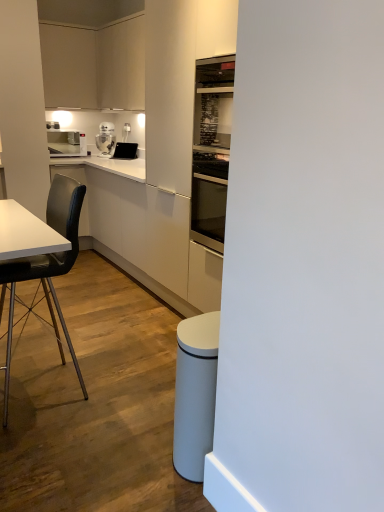
Describe the element at coordinates (94, 65) in the screenshot. I see `matte white cabinet at upper left` at that location.

What is the approximate width of matte black tablet at upper center?

matte black tablet at upper center is 24.46 centimeters wide.

Measure the distance between point (131, 150) and camera.

4.03 meters.

The width and height of the screenshot is (384, 512). What do you see at coordinates (106, 139) in the screenshot? I see `white glossy robot at upper center, arranged as the 2th kitchen appliance when viewed from the left` at bounding box center [106, 139].

Find the location of a particular element. white glossy toaster at upper left, acting as the 2th kitchen appliance starting from the right is located at coordinates (66, 143).

This screenshot has height=512, width=384. What do you see at coordinates (134, 221) in the screenshot?
I see `white glossy counter at center` at bounding box center [134, 221].

You are a GUI agent. You are given a task and a screenshot of the screen. Output one action in this format:
    pyautogui.click(x=<x>, y=<y>)
    Task: Click on the matte white cabinet at upper left
    
    Given the screenshot: What is the action you would take?
    pyautogui.click(x=94, y=65)

From the image's perspective, is black matte chair at left above white glossy counter at center?

No, from the image's perspective, black matte chair at left is not above white glossy counter at center.

Is black matte chair at left oriented away from white glossy counter at center?

That's not correct — black matte chair at left is not looking away from white glossy counter at center.

Is black matte chair at left to the right of white glossy counter at center from the viewer's perspective?

Indeed, black matte chair at left is positioned on the right side of white glossy counter at center.

Is black matte chair at left thinner than white glossy counter at center?

Indeed, black matte chair at left has a lesser width compared to white glossy counter at center.

Can you tell me how much white glossy toaster at upper left, which is the 1th kitchen appliance from left to right, and white glossy robot at upper center, arranged as the 2th kitchen appliance when viewed from the left, differ in facing direction?

The angular difference between white glossy toaster at upper left, which is the 1th kitchen appliance from left to right, and white glossy robot at upper center, arranged as the 2th kitchen appliance when viewed from the left, is 33.6 degrees.

Is white glossy toaster at upper left, which is the 1th kitchen appliance from left to right, taller or shorter than white glossy robot at upper center, acting as the first kitchen appliance starting from the right?

white glossy toaster at upper left, which is the 1th kitchen appliance from left to right, is shorter than white glossy robot at upper center, acting as the first kitchen appliance starting from the right.

Is white glossy toaster at upper left, which is the 1th kitchen appliance from left to right, at the left side of white glossy robot at upper center, acting as the first kitchen appliance starting from the right?

Indeed, white glossy toaster at upper left, which is the 1th kitchen appliance from left to right, is positioned on the left side of white glossy robot at upper center, acting as the first kitchen appliance starting from the right.

From the image's perspective, which is below, black matte chair at left or matte black tablet at upper center?

black matte chair at left appears lower in the image.

From a real-world perspective, who is located higher, black matte chair at left or matte black tablet at upper center?

matte black tablet at upper center is physically above.

Considering the relative positions of black matte chair at left and matte black tablet at upper center in the image provided, is black matte chair at left to the right of matte black tablet at upper center from the viewer's perspective?

No, black matte chair at left is not to the right of matte black tablet at upper center.

Which is in front, point (77, 227) or point (125, 148)?

The point (77, 227) is closer.

Which is further, (86,152) or (131,156)?

Positioned behind is point (86,152).

Is white glossy toaster at upper left, which is the 1th kitchen appliance from left to right, not near matte black tablet at upper center?

No, there isn't a large distance between white glossy toaster at upper left, which is the 1th kitchen appliance from left to right, and matte black tablet at upper center.

In the scene shown: How different are the orientations of white glossy toaster at upper left, acting as the 2th kitchen appliance starting from the right, and matte black tablet at upper center in degrees?

They differ by 50.5 degrees in their facing directions.

From the image's perspective, is white glossy toaster at upper left, acting as the 2th kitchen appliance starting from the right, above matte black tablet at upper center?

Yes.

Is white glossy robot at upper center, acting as the first kitchen appliance starting from the right, shorter than white glossy counter at center?

Correct, white glossy robot at upper center, acting as the first kitchen appliance starting from the right, is not as tall as white glossy counter at center.

From the image's perspective, is white glossy robot at upper center, arranged as the 2th kitchen appliance when viewed from the left, above or below white glossy counter at center?

white glossy robot at upper center, arranged as the 2th kitchen appliance when viewed from the left, is above white glossy counter at center.

Is white glossy robot at upper center, acting as the first kitchen appliance starting from the right, at the right side of white glossy counter at center?

No.

Is white glossy robot at upper center, acting as the first kitchen appliance starting from the right, in contact with matte black tablet at upper center?

white glossy robot at upper center, acting as the first kitchen appliance starting from the right, is not next to matte black tablet at upper center, and they're not touching.

Could you tell me if white glossy robot at upper center, arranged as the 2th kitchen appliance when viewed from the left, is turned towards matte black tablet at upper center?

No, white glossy robot at upper center, arranged as the 2th kitchen appliance when viewed from the left, is not aimed at matte black tablet at upper center.

Where is `kitchen appliance that is the 2nd one when counting upward from the matte black tablet at upper center (from the image's perspective)`? This screenshot has height=512, width=384. kitchen appliance that is the 2nd one when counting upward from the matte black tablet at upper center (from the image's perspective) is located at coordinates pos(106,139).

Consider the image. From the image's perspective, between white glossy robot at upper center, acting as the first kitchen appliance starting from the right, and matte black tablet at upper center, who is located below?

matte black tablet at upper center appears lower in the image.

Is black matte chair at left located within matte white cabinet at upper left?

No, black matte chair at left is not inside matte white cabinet at upper left.

Does matte white cabinet at upper left appear on the left side of black matte chair at left?

Indeed, matte white cabinet at upper left is positioned on the left side of black matte chair at left.

Is matte white cabinet at upper left taller than black matte chair at left?

No, matte white cabinet at upper left is not taller than black matte chair at left.

Considering their positions, is matte white cabinet at upper left located in front of or behind black matte chair at left?

Clearly, matte white cabinet at upper left is behind black matte chair at left.

I want to click on counter behind the black matte chair at left, so click(134, 221).

Identify the location of kitchen appliance that is above the white glossy toaster at upper left, acting as the 2th kitchen appliance starting from the right (from a real-world perspective). (106, 139).

Considering their positions, is matte black tablet at upper center positioned further to white glossy counter at center than matte white cabinet at upper left?

Based on the image, matte white cabinet at upper left appears to be further to white glossy counter at center.

Which object lies further to the anchor point white glossy toaster at upper left, which is the 1th kitchen appliance from left to right, black matte chair at left or white glossy counter at center?

The object further to white glossy toaster at upper left, which is the 1th kitchen appliance from left to right, is black matte chair at left.

Which object lies further to the anchor point white glossy robot at upper center, arranged as the 2th kitchen appliance when viewed from the left, black matte chair at left or white glossy counter at center?

Based on the image, black matte chair at left appears to be further to white glossy robot at upper center, arranged as the 2th kitchen appliance when viewed from the left.

Looking at this image, when comparing their distances from matte black tablet at upper center, does white glossy robot at upper center, arranged as the 2th kitchen appliance when viewed from the left, or black matte chair at left seem closer?

Among the two, white glossy robot at upper center, arranged as the 2th kitchen appliance when viewed from the left, is located nearer to matte black tablet at upper center.

When comparing their distances from matte black tablet at upper center, does matte white cabinet at upper left or white glossy counter at center seem further?

white glossy counter at center lies further to matte black tablet at upper center than the other object.

When comparing their distances from matte black tablet at upper center, does white glossy toaster at upper left, acting as the 2th kitchen appliance starting from the right, or black matte chair at left seem closer?

white glossy toaster at upper left, acting as the 2th kitchen appliance starting from the right, is positioned closer to the anchor matte black tablet at upper center.

Based on their spatial positions, is white glossy counter at center or matte black tablet at upper center further from white glossy robot at upper center, acting as the first kitchen appliance starting from the right?

white glossy counter at center is further to white glossy robot at upper center, acting as the first kitchen appliance starting from the right.

Looking at the image, which one is located closer to matte black tablet at upper center, white glossy robot at upper center, acting as the first kitchen appliance starting from the right, or matte white cabinet at upper left?

Among the two, white glossy robot at upper center, acting as the first kitchen appliance starting from the right, is located nearer to matte black tablet at upper center.

Identify the location of cabinetry located between black matte chair at left and white glossy toaster at upper left, which is the 1th kitchen appliance from left to right, in the depth direction. (94, 65).

Where is `cabinetry between black matte chair at left and white glossy robot at upper center, arranged as the 2th kitchen appliance when viewed from the left, along the z-axis`? cabinetry between black matte chair at left and white glossy robot at upper center, arranged as the 2th kitchen appliance when viewed from the left, along the z-axis is located at coordinates (94, 65).

Locate an element on the screen. appliance between white glossy counter at center and white glossy robot at upper center, arranged as the 2th kitchen appliance when viewed from the left, from front to back is located at coordinates (125, 150).

The height and width of the screenshot is (512, 384). I want to click on kitchen appliance between white glossy counter at center and matte black tablet at upper center from front to back, so click(66, 143).